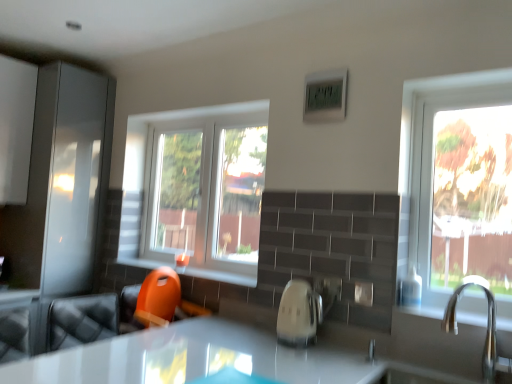
Identify the location of orange plastic toy at lower center. The image size is (512, 384). (220, 276).

This screenshot has height=384, width=512. Describe the element at coordinates (487, 323) in the screenshot. I see `silver metallic faucet at right` at that location.

The height and width of the screenshot is (384, 512). Find the location of `silver metallic faucet at right`. silver metallic faucet at right is located at coordinates (x=487, y=323).

Identify the location of clear glass window at center. (196, 187).

The image size is (512, 384). In order to click on orange plastic swivel chair at lower left in this screenshot , I will do `click(155, 302)`.

What is the approximate height of orange plastic swivel chair at lower left?

orange plastic swivel chair at lower left is 15.25 inches in height.

Where is `white glossy kettle at center`? The image size is (512, 384). white glossy kettle at center is located at coordinates (298, 314).

Which is nearer, (298, 320) or (149, 261)?

The point (298, 320) is more forward.

Which of these two, white glossy kettle at center or orange plastic toy at lower center, is smaller?

white glossy kettle at center is smaller.

Is white glossy kettle at center to the right of orange plastic toy at lower center from the viewer's perspective?

Yes, white glossy kettle at center is to the right of orange plastic toy at lower center.

From their relative heights in the image, would you say white glossy kettle at center is taller or shorter than orange plastic toy at lower center?

white glossy kettle at center is taller than orange plastic toy at lower center.

How many degrees apart are the facing directions of white glossy kettle at center and orange plastic swivel chair at lower left?

The angular difference between white glossy kettle at center and orange plastic swivel chair at lower left is 90.7 degrees.

Between white glossy kettle at center and orange plastic swivel chair at lower left, which one has smaller size?

With smaller size is white glossy kettle at center.

Is white glossy kettle at center facing away from orange plastic swivel chair at lower left?

No.

Which object is wider, white glossy kettle at center or orange plastic swivel chair at lower left?

orange plastic swivel chair at lower left.

Does clear glass window at center touch white glossy kettle at center?

No.

Which of these two, clear glass window at center or white glossy kettle at center, is smaller?

white glossy kettle at center.

Is clear glass window at center closer to the viewer compared to white glossy kettle at center?

No.

Can we say orange plastic toy at lower center lies outside clear glass window at center?

Indeed, orange plastic toy at lower center is completely outside clear glass window at center.

Based on their sizes in the image, would you say orange plastic toy at lower center is bigger or smaller than clear glass window at center?

orange plastic toy at lower center is smaller than clear glass window at center.

From a real-world perspective, is orange plastic toy at lower center positioned above or below clear glass window at center?

From a real-world perspective, orange plastic toy at lower center is physically below clear glass window at center.

What's the angular difference between silver metallic faucet at right and matte gray cabinet at left's facing directions?

The facing directions of silver metallic faucet at right and matte gray cabinet at left are 89.1 degrees apart.

Considering the relative sizes of silver metallic faucet at right and matte gray cabinet at left in the image provided, is silver metallic faucet at right taller than matte gray cabinet at left?

In fact, silver metallic faucet at right may be shorter than matte gray cabinet at left.

Is silver metallic faucet at right positioned with its back to matte gray cabinet at left?

No, silver metallic faucet at right's orientation is not away from matte gray cabinet at left.

Would you say silver metallic faucet at right is inside or outside matte gray cabinet at left?

silver metallic faucet at right is not enclosed by matte gray cabinet at left.

What's the angular difference between white glossy kettle at center and matte gray cabinet at left's facing directions?

The angle between the facing direction of white glossy kettle at center and the facing direction of matte gray cabinet at left is 90.4 degrees.

From a real-world perspective, between white glossy kettle at center and matte gray cabinet at left, who is vertically higher?

In real-world perspective, matte gray cabinet at left is above.

The height and width of the screenshot is (384, 512). In the image, there is a matte gray cabinet at left. What are the coordinates of `appliance below it (from the image's perspective)` in the screenshot? It's located at (298, 314).

In the scene shown: Considering the relative positions of matte gray cabinet at left and orange plastic toy at lower center in the image provided, is matte gray cabinet at left to the left or to the right of orange plastic toy at lower center?

matte gray cabinet at left is positioned on orange plastic toy at lower center's left side.

Can you confirm if matte gray cabinet at left is wider than orange plastic toy at lower center?

Correct, the width of matte gray cabinet at left exceeds that of orange plastic toy at lower center.

From the image's perspective, is matte gray cabinet at left above orange plastic toy at lower center?

Indeed, from the image's perspective, matte gray cabinet at left is shown above orange plastic toy at lower center.

Based on the photo, is matte gray cabinet at left further to the viewer compared to orange plastic toy at lower center?

Yes, matte gray cabinet at left is further from the camera.

Where is `window sill behind the white glossy kettle at center`? The width and height of the screenshot is (512, 384). window sill behind the white glossy kettle at center is located at coordinates (220, 276).

Where is `appliance in front of the orange plastic swivel chair at lower left`? This screenshot has width=512, height=384. appliance in front of the orange plastic swivel chair at lower left is located at coordinates (298, 314).

From the picture: Estimate the real-world distances between objects in this image. Which object is further from orange plastic swivel chair at lower left, matte gray cabinet at left or white glossy kettle at center?

The object further to orange plastic swivel chair at lower left is matte gray cabinet at left.

Looking at the image, which one is located closer to white glossy kettle at center, clear glass window at center or matte gray cabinet at left?

clear glass window at center is closer to white glossy kettle at center.

When comparing their distances from white glossy kettle at center, does orange plastic toy at lower center or clear glass window at center seem further?

clear glass window at center is positioned further to the anchor white glossy kettle at center.

Based on the photo, considering their positions, is silver metallic faucet at right positioned further to white glossy kettle at center than clear glass window at center?

Based on the image, clear glass window at center appears to be further to white glossy kettle at center.

Based on their spatial positions, is white glossy kettle at center or matte gray cabinet at left closer to orange plastic toy at lower center?

Among the two, white glossy kettle at center is located nearer to orange plastic toy at lower center.

From the image, which object appears to be farther from white glossy kettle at center, matte gray cabinet at left or clear glass window at center?

matte gray cabinet at left.

Based on their spatial positions, is clear glass window at center or silver metallic faucet at right closer to white glossy kettle at center?

silver metallic faucet at right is closer to white glossy kettle at center.

Estimate the real-world distances between objects in this image. Which object is further from clear glass window at center, silver metallic faucet at right or orange plastic toy at lower center?

Among the two, silver metallic faucet at right is located further to clear glass window at center.

The height and width of the screenshot is (384, 512). Identify the location of swivel chair situated between matte gray cabinet at left and clear glass window at center from left to right. (155, 302).

Find the location of a particular element. The height and width of the screenshot is (384, 512). window sill between clear glass window at center and orange plastic swivel chair at lower left in the up-down direction is located at coordinates (x=220, y=276).

This screenshot has width=512, height=384. Identify the location of window between orange plastic swivel chair at lower left and silver metallic faucet at right in the horizontal direction. (196, 187).

Find the location of a particular element. This screenshot has width=512, height=384. window situated between orange plastic swivel chair at lower left and white glossy kettle at center from left to right is located at coordinates (196, 187).